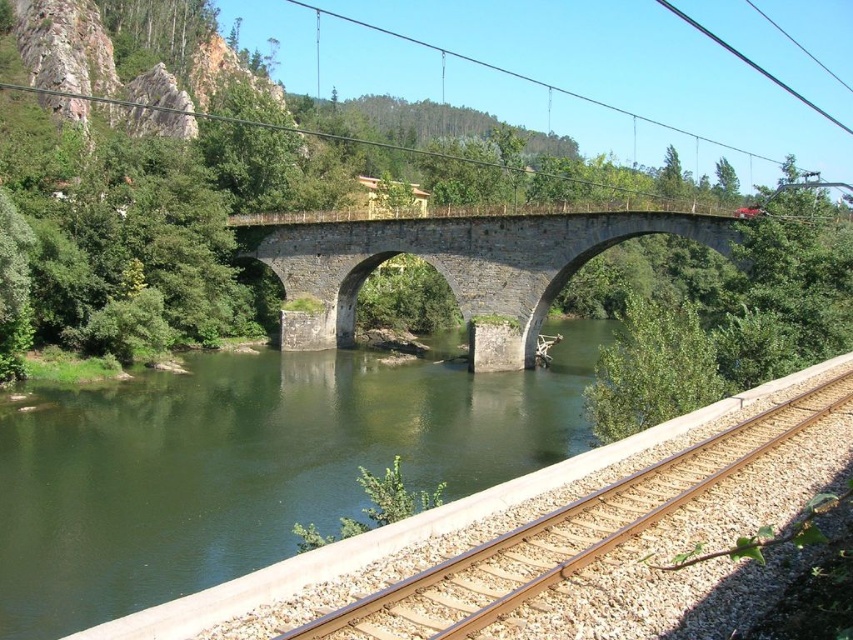
Question: Based on their relative distances, which object is nearer to the brown gravel track at lower right?

Choices:
 (A) stone arch bridge at center
 (B) green stone river at center

Answer: (B)

Question: Among these objects, which one is farthest from the camera?

Choices:
 (A) brown gravel track at lower right
 (B) stone arch bridge at center

Answer: (B)

Question: Which is nearer to the green stone river at center?

Choices:
 (A) stone arch bridge at center
 (B) brown gravel track at lower right

Answer: (A)

Question: Does green stone river at center appear over stone arch bridge at center?

Choices:
 (A) yes
 (B) no

Answer: (B)

Question: Observing the image, what is the correct spatial positioning of stone arch bridge at center in reference to brown gravel track at lower right?

Choices:
 (A) below
 (B) above

Answer: (B)

Question: Does green stone river at center appear under brown gravel track at lower right?

Choices:
 (A) yes
 (B) no

Answer: (A)